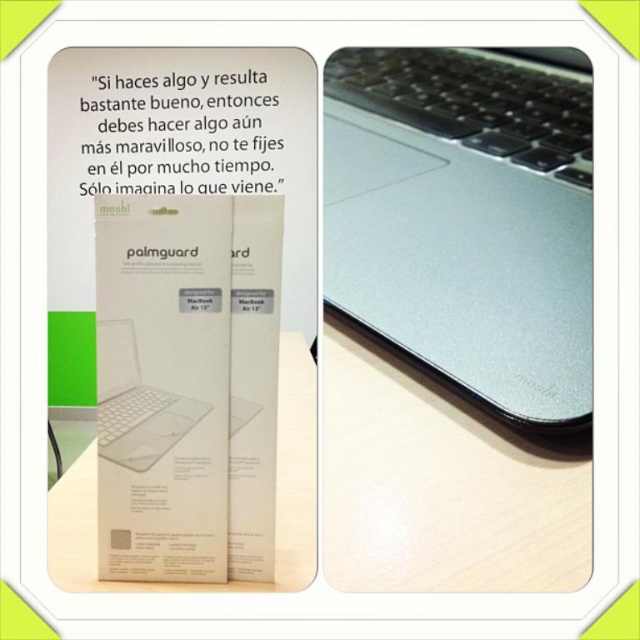
Question: Among these points, which one is nearest to the camera?

Choices:
 (A) (212, 589)
 (B) (176, 435)
 (C) (369, 536)

Answer: (A)

Question: Can you confirm if satin silver laptop at center is positioned to the left of sleek silver laptop at center?

Choices:
 (A) no
 (B) yes

Answer: (A)

Question: Is wooden table at center above metallic silver mousepad at center?

Choices:
 (A) yes
 (B) no

Answer: (A)

Question: Which point is closer to the camera taking this photo?

Choices:
 (A) (132, 406)
 (B) (163, 588)

Answer: (B)

Question: Can you confirm if wooden table at center is bigger than sleek silver laptop at center?

Choices:
 (A) yes
 (B) no

Answer: (A)

Question: Estimate the real-world distances between objects in this image. Which object is closer to the metallic silver mousepad at center?

Choices:
 (A) sleek silver laptop at center
 (B) wooden table at center
 (C) satin silver laptop at center

Answer: (A)